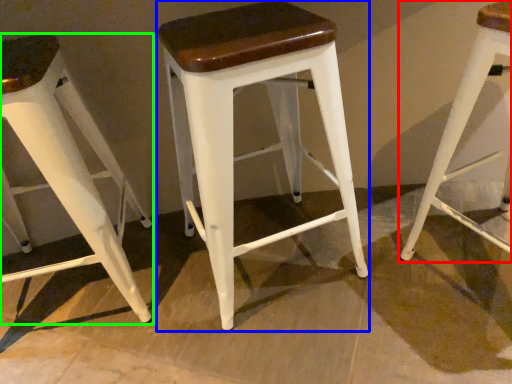
Question: Which object is positioned farthest from stool (highlighted by a red box)? Select from stool (highlighted by a blue box) and stool (highlighted by a green box).

Choices:
 (A) stool
 (B) stool

Answer: (B)